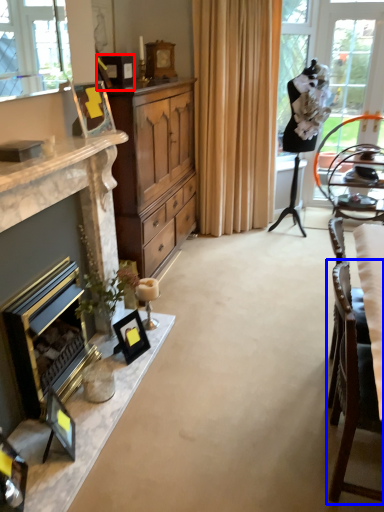
Question: Which point is closer to the camera, picture frame (highlighted by a red box) or chair (highlighted by a blue box)?

Choices:
 (A) picture frame
 (B) chair

Answer: (B)